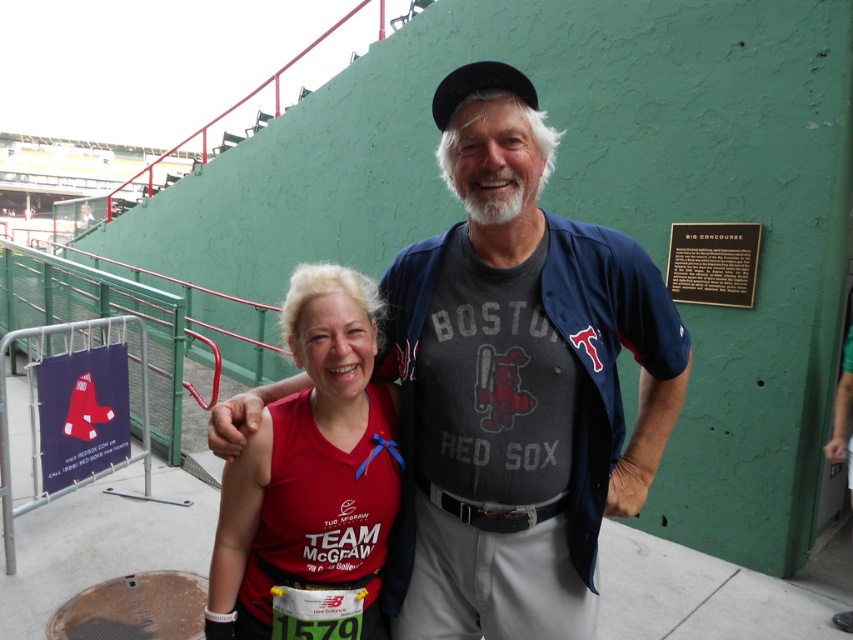
Based on the photo, you are a photographer at a sports event and need to arrange the two athletes in a photo. The dark blue jersey at center and the matte red shirt at center must be visible. Which athlete should stand to the left to ensure both are framed properly?

The athlete wearing the matte red shirt at center should stand to the left because the dark blue jersey at center is positioned on the right side of it, so placing the matte red shirt at center on the left will align with their current positions.

In the scene shown: You are at a sports event and want to take a photo with the two people in the image. The camera you are using has a limited focus range. Since the dark blue jersey at center and the matte red shirt at center are both in the frame, which one is more likely to be in focus if the camera focuses on the closer object?

The matte red shirt at center is smaller than the dark blue jersey at center, so if the camera focuses on the closer object, the matte red shirt at center would be in focus because it is closer to the camera.